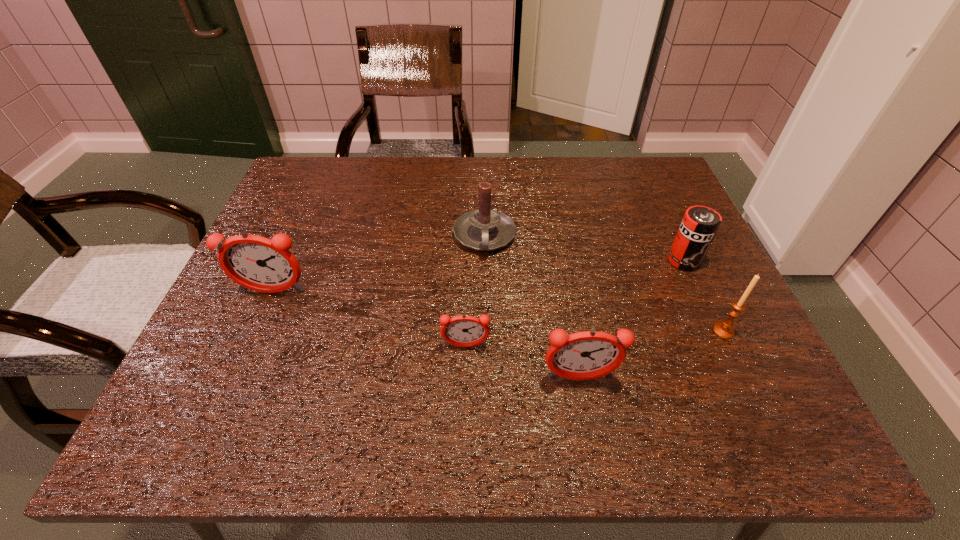
Please point a space for a new alarm_clock to maintain equal intervals. Please provide its 2D coordinates. Your answer should be formatted as a tuple, i.e. [(x, y)], where the tuple contains the x and y coordinates of a point satisfying the conditions above.

[(364, 318)]